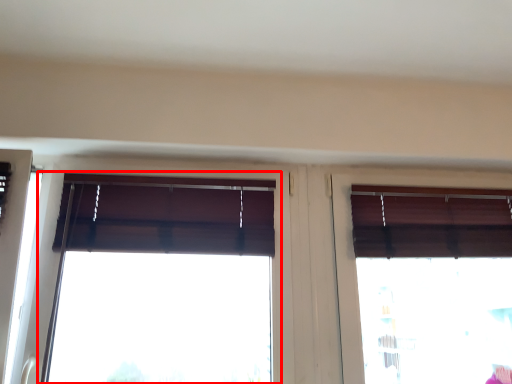
Question: Considering the relative positions of window (annotated by the red box) and window in the image provided, where is window (annotated by the red box) located with respect to the staircase?

Choices:
 (A) left
 (B) right

Answer: (A)